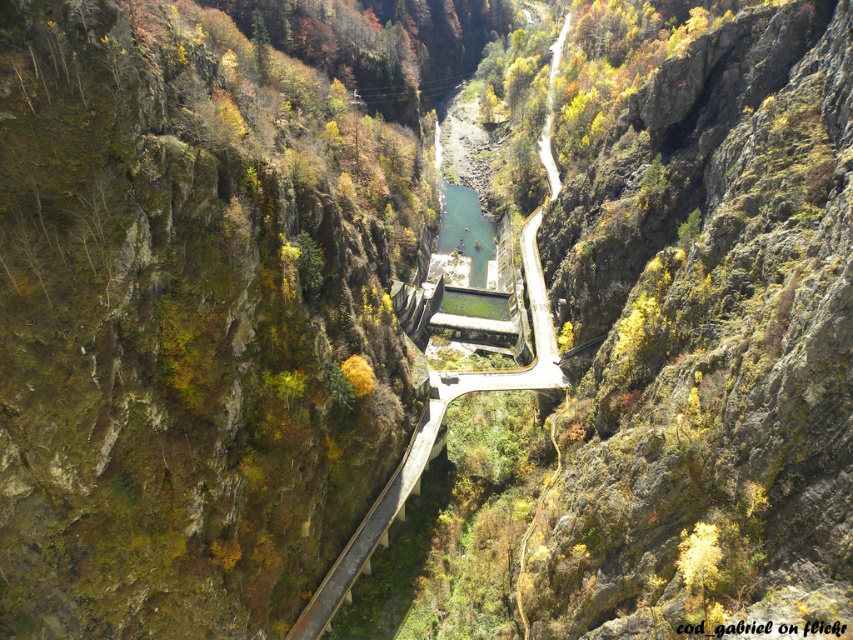
You are standing at the camera position and want to reach point [321,632]. Is the distance more than 300 feet?

The distance between point [321,632] and the camera is 373.44 feet, which is more than 300 feet.

You are a hiker planning to cross the canyon using the paved road. You notice the concrete at center and the green stone river at center. Which one should you avoid stepping on to stay on the road?

You should avoid stepping on the green stone river at center because the concrete at center is part of the paved road, while the green stone river at center is the flowing water that you need to avoid.

You are a drone operator planning to capture a photo of the concrete at center from a safe altitude. The minimum safe distance for your drone to maintain from any structure is 300 feet. Based on the scene, can you confirm if the drone can safely take the photo?

The distance of concrete at center from camera is 365.48 feet, which exceeds the minimum safe distance of 300 feet. Therefore, the drone can safely take the photo.